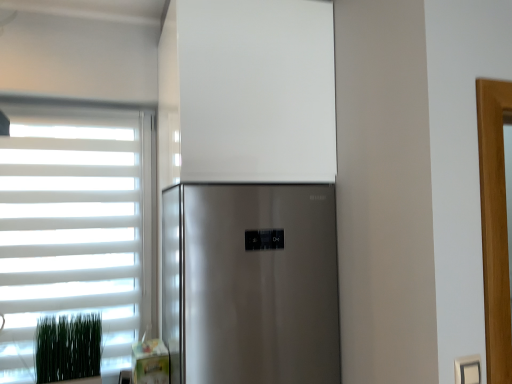
Consider the image. What is the approximate height of white plastic electric outlet at lower right?

white plastic electric outlet at lower right is 8.82 centimeters tall.

At what (x,y) coordinates should I click in order to perform the action: click on white matte window at left. Please return your answer as a coordinate pair (x, y). This screenshot has height=384, width=512. Looking at the image, I should click on (76, 226).

Identify the location of satin silver refrigerator at center. This screenshot has height=384, width=512. (250, 283).

Where is `white plastic electric outlet at lower right`? white plastic electric outlet at lower right is located at coordinates [468, 370].

Consider the image. Could you tell me if satin silver refrigerator at center is turned towards white plastic electric outlet at lower right?

Yes, satin silver refrigerator at center is aimed at white plastic electric outlet at lower right.

From a real-world perspective, does satin silver refrigerator at center sit lower than white plastic electric outlet at lower right?

No, from a real-world perspective, satin silver refrigerator at center is not under white plastic electric outlet at lower right.

From the image's perspective, does satin silver refrigerator at center appear lower than white plastic electric outlet at lower right?

No.

Considering the relative positions of satin silver refrigerator at center and white plastic electric outlet at lower right in the image provided, is satin silver refrigerator at center in front of white plastic electric outlet at lower right?

No, the depth of satin silver refrigerator at center is greater than that of white plastic electric outlet at lower right.

Considering the points (77, 344) and (182, 201), which point is behind, point (77, 344) or point (182, 201)?

Point (77, 344)

Can you see green grass at lower left touching satin silver refrigerator at center?

green grass at lower left and satin silver refrigerator at center are not in contact.

Considering their positions, is green grass at lower left located in front of or behind satin silver refrigerator at center?

In the image, green grass at lower left appears behind satin silver refrigerator at center.

In terms of width, does green grass at lower left look wider or thinner when compared to satin silver refrigerator at center?

In the image, green grass at lower left appears to be more narrow than satin silver refrigerator at center.

In the scene shown: Is white matte window at left in front of white plastic electric outlet at lower right?

No, it is not.

Who is bigger, white matte window at left or white plastic electric outlet at lower right?

white matte window at left is bigger.

Which is closer to the camera, (100, 267) or (460, 375)?

Point (100, 267) is farther from the camera than point (460, 375).

From the image's perspective, is white plastic electric outlet at lower right located beneath satin silver refrigerator at center?

Yes.

Is white plastic electric outlet at lower right to the right of satin silver refrigerator at center from the viewer's perspective?

Yes, white plastic electric outlet at lower right is to the right of satin silver refrigerator at center.

In the image, there is a white plastic electric outlet at lower right. In order to click on refrigerator above it (from the image's perspective) in this screenshot , I will do `click(250, 283)`.

Is white matte window at left shorter than satin silver refrigerator at center?

No, white matte window at left is not shorter than satin silver refrigerator at center.

Does white matte window at left touch satin silver refrigerator at center?

No, white matte window at left is not next to satin silver refrigerator at center.

Does white matte window at left lie behind satin silver refrigerator at center?

Yes, it is behind satin silver refrigerator at center.

From the image's perspective, is white matte window at left under satin silver refrigerator at center?

Actually, white matte window at left appears above satin silver refrigerator at center in the image.

Between green grass at lower left and white matte window at left, which one is positioned in front?

green grass at lower left.

How different are the orientations of green grass at lower left and white matte window at left in degrees?

The facing directions of green grass at lower left and white matte window at left are 8 degrees apart.

Is green grass at lower left surrounding white matte window at left?

No, white matte window at left is not a part of green grass at lower left.

Is green grass at lower left taller or shorter than white matte window at left?

green grass at lower left is shorter than white matte window at left.

Is satin silver refrigerator at center further to camera compared to green grass at lower left?

That is False.

From a real-world perspective, is satin silver refrigerator at center under green grass at lower left?

→ Incorrect, from a real-world perspective, satin silver refrigerator at center is higher than green grass at lower left.

Considering the sizes of satin silver refrigerator at center and green grass at lower left in the image, is satin silver refrigerator at center taller or shorter than green grass at lower left?

Considering their sizes, satin silver refrigerator at center has more height than green grass at lower left.

Is satin silver refrigerator at center positioned far away from green grass at lower left?

No, satin silver refrigerator at center is not far from green grass at lower left.

Identify the location of electric outlet that appears below the satin silver refrigerator at center (from a real-world perspective). (468, 370).

Identify the location of refrigerator in front of the green grass at lower left. This screenshot has height=384, width=512. (250, 283).

When comparing their distances from white plastic electric outlet at lower right, does satin silver refrigerator at center or white matte window at left seem closer?

satin silver refrigerator at center is closer to white plastic electric outlet at lower right.

Which object lies further to the anchor point green grass at lower left, satin silver refrigerator at center or white matte window at left?

satin silver refrigerator at center lies further to green grass at lower left than the other object.

Which object lies nearer to the anchor point green grass at lower left, white matte window at left or satin silver refrigerator at center?

white matte window at left is closer to green grass at lower left.

From the image, which object appears to be nearer to green grass at lower left, white plastic electric outlet at lower right or satin silver refrigerator at center?

satin silver refrigerator at center is closer to green grass at lower left.

When comparing their distances from white plastic electric outlet at lower right, does satin silver refrigerator at center or green grass at lower left seem further?

Among the two, green grass at lower left is located further to white plastic electric outlet at lower right.

Looking at the image, which one is located closer to satin silver refrigerator at center, green grass at lower left or white plastic electric outlet at lower right?

white plastic electric outlet at lower right is positioned closer to the anchor satin silver refrigerator at center.

Based on their spatial positions, is white plastic electric outlet at lower right or green grass at lower left further from white matte window at left?

white plastic electric outlet at lower right lies further to white matte window at left than the other object.

When comparing their distances from white matte window at left, does white plastic electric outlet at lower right or satin silver refrigerator at center seem further?

white plastic electric outlet at lower right is positioned further to the anchor white matte window at left.

This screenshot has width=512, height=384. I want to click on refrigerator between white matte window at left and white plastic electric outlet at lower right, so click(250, 283).

Where is `plant between white matte window at left and satin silver refrigerator at center from left to right`? The width and height of the screenshot is (512, 384). plant between white matte window at left and satin silver refrigerator at center from left to right is located at coordinates (68, 348).

The width and height of the screenshot is (512, 384). In order to click on refrigerator situated between green grass at lower left and white plastic electric outlet at lower right from left to right in this screenshot , I will do `click(250, 283)`.

Identify the location of plant located between white matte window at left and white plastic electric outlet at lower right in the left-right direction. The width and height of the screenshot is (512, 384). 68,348.